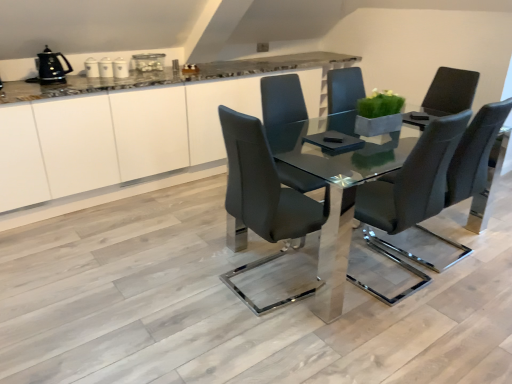
Question: Should I look upward or downward to see matte black chair at center, arranged as the first chair when viewed from the left?

Choices:
 (A) up
 (B) down

Answer: (B)

Question: From the image's perspective, does matte black chair at center, the first chair when ordered from right to left, appear higher than clear glass table at center?

Choices:
 (A) yes
 (B) no

Answer: (A)

Question: Does matte black chair at center, the first chair when ordered from right to left, have a greater height compared to clear glass table at center?

Choices:
 (A) no
 (B) yes

Answer: (B)

Question: From a real-world perspective, is matte black chair at center, acting as the second chair starting from the left, located higher than clear glass table at center?

Choices:
 (A) yes
 (B) no

Answer: (A)

Question: Does matte black chair at center, acting as the second chair starting from the left, lie behind clear glass table at center?

Choices:
 (A) no
 (B) yes

Answer: (B)

Question: From a real-world perspective, is matte black chair at center, acting as the second chair starting from the left, beneath clear glass table at center?

Choices:
 (A) no
 (B) yes

Answer: (A)

Question: Can you confirm if matte black chair at center, acting as the second chair starting from the left, is positioned to the left of clear glass table at center?

Choices:
 (A) yes
 (B) no

Answer: (B)

Question: Does white glossy cabinetry at center have a larger size compared to clear glass table at center?

Choices:
 (A) yes
 (B) no

Answer: (A)

Question: Does white glossy cabinetry at center have a lesser height compared to clear glass table at center?

Choices:
 (A) yes
 (B) no

Answer: (B)

Question: From a real-world perspective, is white glossy cabinetry at center located beneath clear glass table at center?

Choices:
 (A) yes
 (B) no

Answer: (B)

Question: Does white glossy cabinetry at center have a greater width compared to clear glass table at center?

Choices:
 (A) yes
 (B) no

Answer: (B)

Question: Is white glossy cabinetry at center surrounding clear glass table at center?

Choices:
 (A) no
 (B) yes

Answer: (A)

Question: Is white glossy cabinetry at center at the right side of clear glass table at center?

Choices:
 (A) yes
 (B) no

Answer: (B)

Question: Is clear glass table at center oriented away from green matte planter at center?

Choices:
 (A) no
 (B) yes

Answer: (A)